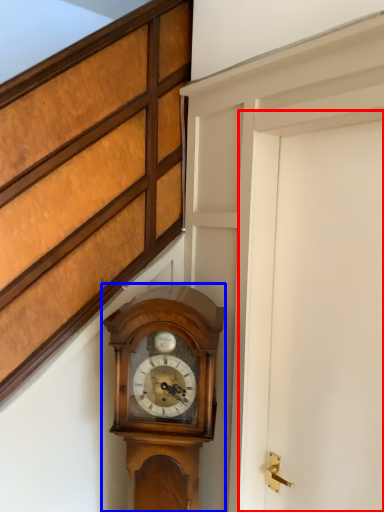
Question: Which point is further to the camera, door (highlighted by a red box) or wall clock (highlighted by a blue box)?

Choices:
 (A) door
 (B) wall clock

Answer: (B)